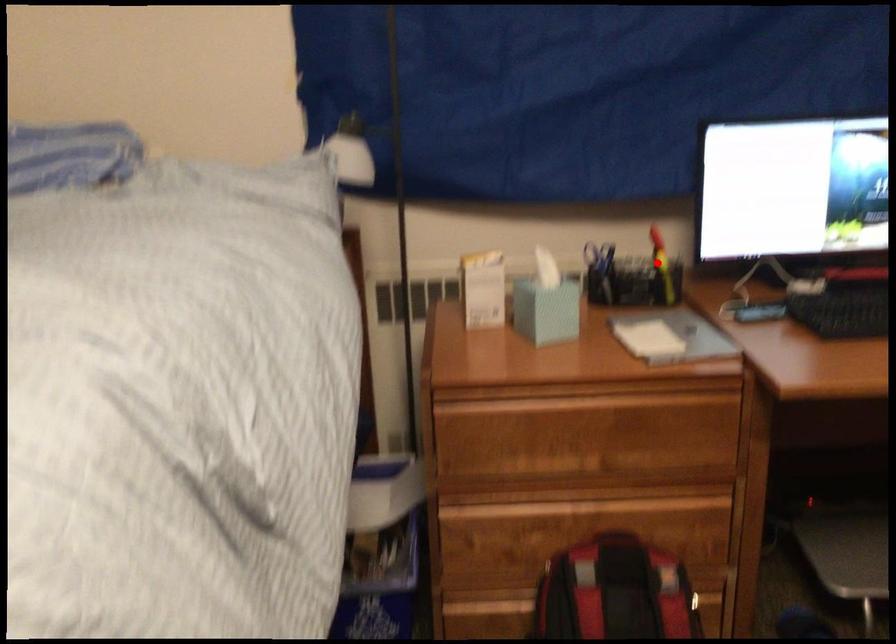
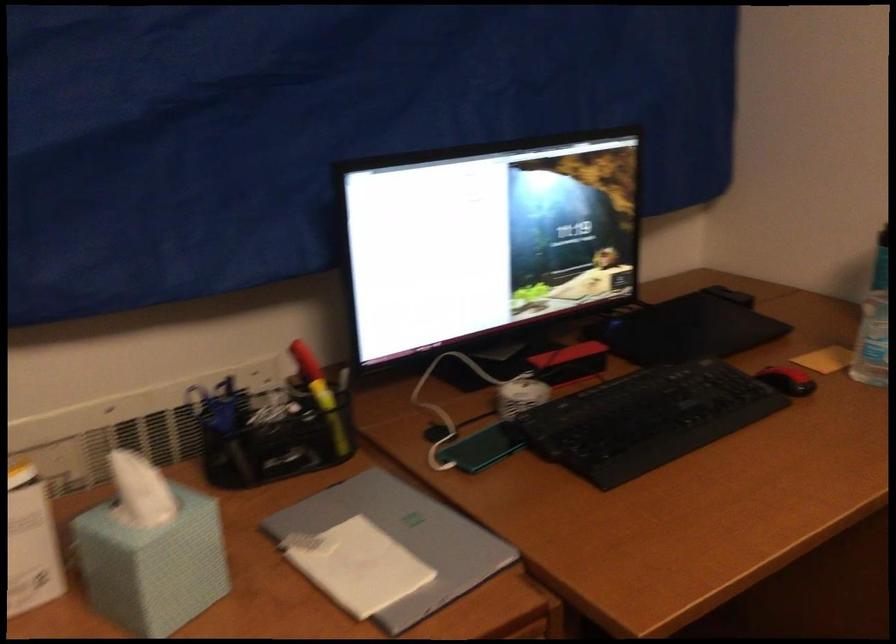
Question: I am providing you with two images of the same scene from different viewpoints. Image1 has a red point marked. In image2, the corresponding 3D location appears at what relative position? Reply with the corresponding letter.

Choices:
 (A) Closer
 (B) Farther

Answer: (A)